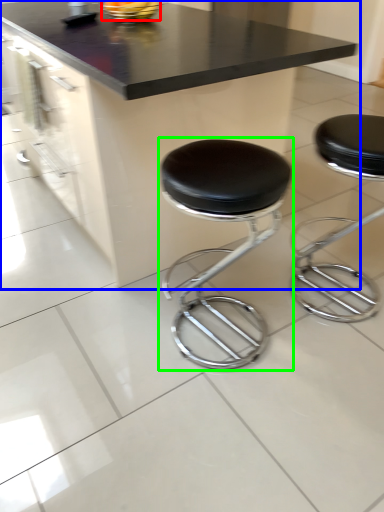
Question: Estimate the real-world distances between objects in this image. Which object is farther from food (highlighted by a red box), table (highlighted by a blue box) or stool (highlighted by a green box)?

Choices:
 (A) table
 (B) stool

Answer: (B)